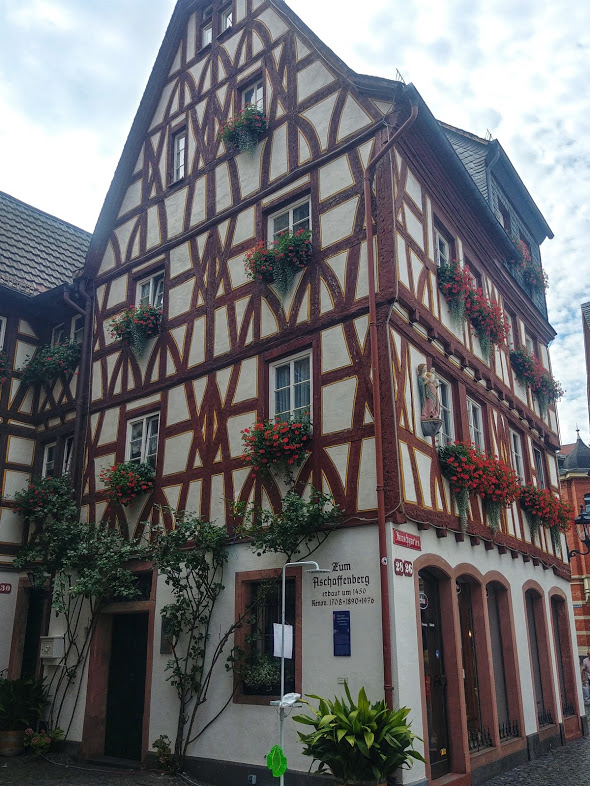
Locate an element on the screen. The width and height of the screenshot is (590, 786). walls is located at coordinates (244, 713), (215, 435), (218, 277), (204, 174), (409, 255), (421, 468), (402, 652), (17, 482), (8, 612), (13, 358).